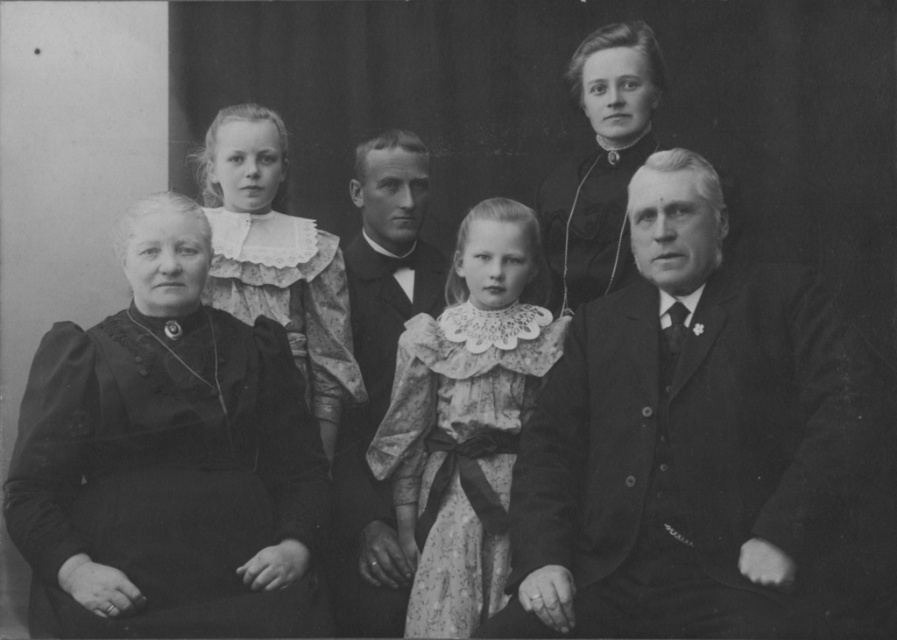
Which is in front, point (142, 448) or point (449, 545)?

Point (142, 448) is more forward.

At what (x,y) coordinates should I click in order to perform the action: click on black velvet dress at left. Please return your answer as a coordinate pair (x, y). Looking at the image, I should click on (167, 460).

Between black velvet dress at left and matte black dress at upper center, which one appears on the left side from the viewer's perspective?

black velvet dress at left

Is black velvet dress at left taller than matte black dress at upper center?

Indeed, black velvet dress at left has a greater height compared to matte black dress at upper center.

Is point (39, 371) more distant than point (544, 241)?

No, it is in front of (544, 241).

Where is `black velvet dress at left`? black velvet dress at left is located at coordinates (167, 460).

Does smooth black suit at right appear on the right side of matte black dress at upper center?

Correct, you'll find smooth black suit at right to the right of matte black dress at upper center.

Who is higher up, smooth black suit at right or matte black dress at upper center?

matte black dress at upper center is above.

The width and height of the screenshot is (897, 640). Identify the location of smooth black suit at right. (686, 442).